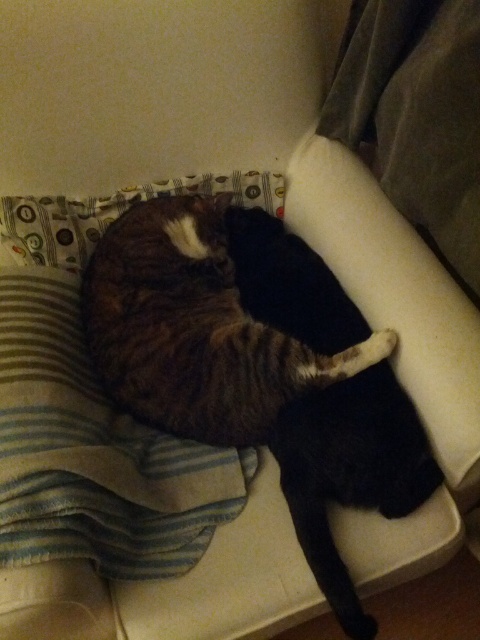
Which of these two, striped fleece blanket at lower left or tabby fur cat at center, stands taller?

Standing taller between the two is striped fleece blanket at lower left.

Consider the image. Who is positioned more to the right, striped fleece blanket at lower left or tabby fur cat at center?

Positioned to the right is tabby fur cat at center.

Is point (47, 346) closer to viewer compared to point (139, 205)?

Yes.

Locate an element on the screen. striped fleece blanket at lower left is located at coordinates (94, 452).

How much distance is there between striped fleece blanket at lower left and striped fur cat at center?

striped fleece blanket at lower left and striped fur cat at center are 28.51 centimeters apart.

What do you see at coordinates (94, 452) in the screenshot? The height and width of the screenshot is (640, 480). I see `striped fleece blanket at lower left` at bounding box center [94, 452].

Is point (3, 493) more distant than point (364, 636)?

That is False.

Locate an element on the screen. This screenshot has width=480, height=640. striped fleece blanket at lower left is located at coordinates (94, 452).

The height and width of the screenshot is (640, 480). Describe the element at coordinates (194, 328) in the screenshot. I see `tabby fur cat at center` at that location.

Which is behind, point (303, 346) or point (347, 486)?

Positioned behind is point (303, 346).

Find the location of `tabby fur cat at center`. tabby fur cat at center is located at coordinates (194, 328).